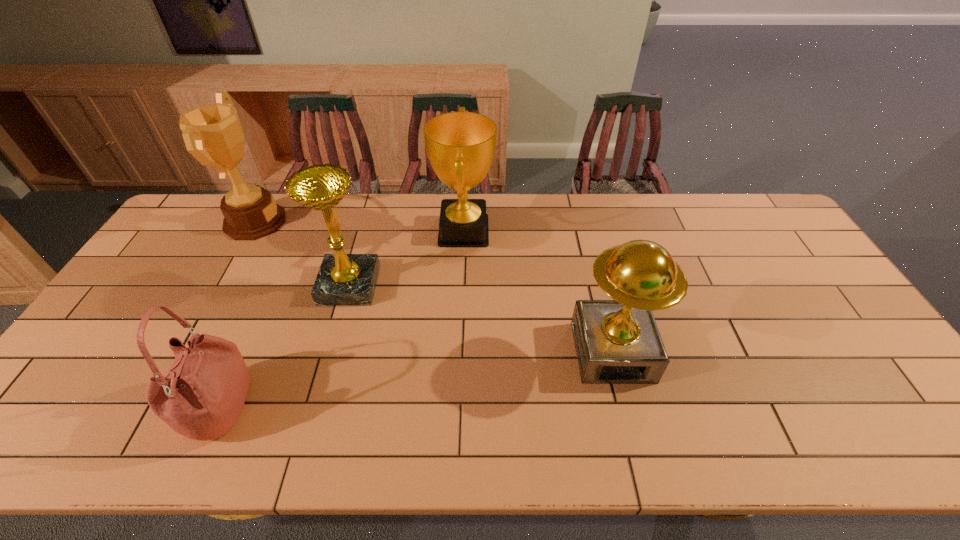
Locate an element on the screen. the leftmost award is located at coordinates click(x=213, y=134).

At what (x,y) coordinates should I click in order to perform the action: click on the fourth object from left to right. Please return your answer as a coordinate pair (x, y). This screenshot has width=960, height=540. Looking at the image, I should click on (461, 146).

I want to click on the third object from left to right, so click(343, 279).

The image size is (960, 540). I want to click on the third farthest object, so click(x=343, y=279).

This screenshot has height=540, width=960. Find the location of `the nearest award`. the nearest award is located at coordinates (617, 341).

This screenshot has height=540, width=960. In order to click on the rightmost object in this screenshot , I will do `click(617, 341)`.

The height and width of the screenshot is (540, 960). Identify the location of handbag. click(x=201, y=396).

Find the location of a particular element. vacant region located 0.090m on the front-facing side of the leftmost award is located at coordinates (312, 221).

Locate an element on the screen. vacant region located on the front-facing side of the second object from right to left is located at coordinates (533, 231).

At what (x,y) coordinates should I click in order to perform the action: click on vacant space located on the front-facing side of the third nearest object. Please return your answer as a coordinate pair (x, y). Looking at the image, I should click on pos(437,285).